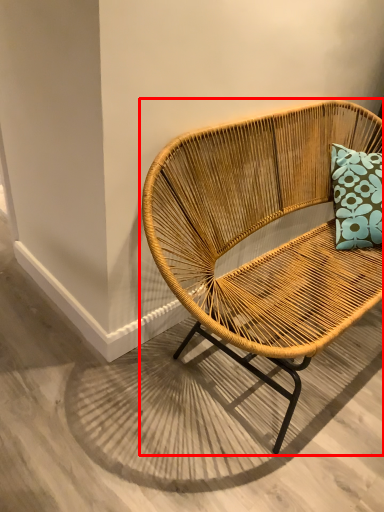
Question: From the image's perspective, what is the correct spatial positioning of chair (annotated by the red box) in reference to concrete?

Choices:
 (A) below
 (B) above

Answer: (B)